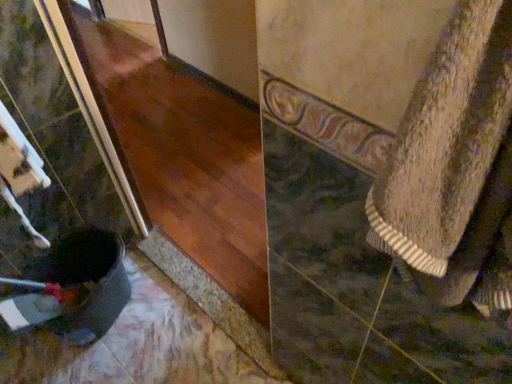
Measure the distance between point (443, 122) and camera.

Point (443, 122) and camera are 31.70 centimeters apart.

The image size is (512, 384). What do you see at coordinates (446, 139) in the screenshot?
I see `textured beige towel at right` at bounding box center [446, 139].

In order to face textured beige towel at right, should I rotate leftwards or rightwards?

You should look right and rotate roughly 26.983 degrees.

This screenshot has width=512, height=384. I want to click on textured beige towel at right, so click(x=446, y=139).

The height and width of the screenshot is (384, 512). What do you see at coordinates (183, 156) in the screenshot? I see `glossy wood at lower left` at bounding box center [183, 156].

At what (x,y) coordinates should I click in order to perform the action: click on glossy wood at lower left. Please return your answer as a coordinate pair (x, y). This screenshot has width=512, height=384. Looking at the image, I should click on (183, 156).

Where is `textured beige towel at right`? The image size is (512, 384). textured beige towel at right is located at coordinates (446, 139).

Which object is positioned more to the right, textured beige towel at right or glossy wood at lower left?

From the viewer's perspective, textured beige towel at right appears more on the right side.

In the image, is textured beige towel at right positioned in front of or behind glossy wood at lower left?

textured beige towel at right is in front of glossy wood at lower left.

Is point (396, 218) positioned after point (111, 66)?

No, (396, 218) is in front of (111, 66).

From the image's perspective, would you say textured beige towel at right is shown under glossy wood at lower left?

Indeed, from the image's perspective, textured beige towel at right is shown beneath glossy wood at lower left.

In the scene shown: From a real-world perspective, who is located higher, textured beige towel at right or glossy wood at lower left?

In real-world perspective, textured beige towel at right is above.

Considering the relative sizes of textured beige towel at right and glossy wood at lower left in the image provided, is textured beige towel at right thinner than glossy wood at lower left?

Incorrect, the width of textured beige towel at right is not less than that of glossy wood at lower left.

From their relative heights in the image, would you say textured beige towel at right is taller or shorter than glossy wood at lower left?

Clearly, textured beige towel at right is shorter compared to glossy wood at lower left.

Can you confirm if textured beige towel at right is smaller than glossy wood at lower left?

Yes, textured beige towel at right is smaller than glossy wood at lower left.

Can we say textured beige towel at right lies outside glossy wood at lower left?

Yes, textured beige towel at right is not within glossy wood at lower left.

Based on the photo, would you consider textured beige towel at right to be distant from glossy wood at lower left?

Yes, textured beige towel at right and glossy wood at lower left are quite far apart.

Is textured beige towel at right aimed at glossy wood at lower left?

No, textured beige towel at right is not facing towards glossy wood at lower left.

How far apart are textured beige towel at right and glossy wood at lower left?

The distance of textured beige towel at right from glossy wood at lower left is 5.65 feet.

Locate an element on the screen. Image resolution: width=512 pixels, height=384 pixels. wood below the textured beige towel at right (from a real-world perspective) is located at coordinates (183, 156).

Is glossy wood at lower left to the left of textured beige towel at right from the viewer's perspective?

Indeed, glossy wood at lower left is positioned on the left side of textured beige towel at right.

Between glossy wood at lower left and textured beige towel at right, which one is positioned in front?

textured beige towel at right is in front.

Is point (129, 96) farther from camera compared to point (426, 165)?

Yes.

From the image's perspective, is glossy wood at lower left positioned above or below textured beige towel at right?

glossy wood at lower left is above textured beige towel at right.

From a real-world perspective, which object stands above the other?

textured beige towel at right.

Can you confirm if glossy wood at lower left is wider than textured beige towel at right?

No.

Considering the relative sizes of glossy wood at lower left and textured beige towel at right in the image provided, is glossy wood at lower left shorter than textured beige towel at right?

Incorrect, the height of glossy wood at lower left does not fall short of that of textured beige towel at right.

Which of these two, glossy wood at lower left or textured beige towel at right, is smaller?

textured beige towel at right.

Would you say glossy wood at lower left is outside textured beige towel at right?

That's correct, glossy wood at lower left is outside of textured beige towel at right.

Is glossy wood at lower left placed right next to textured beige towel at right?

glossy wood at lower left and textured beige towel at right are clearly separated.

Could you tell me if glossy wood at lower left is facing textured beige towel at right?

No, glossy wood at lower left is not turned towards textured beige towel at right.

How different are the orientations of glossy wood at lower left and textured beige towel at right in degrees?

There is a 0.872-degree angle between the facing directions of glossy wood at lower left and textured beige towel at right.

How distant is glossy wood at lower left from textured beige towel at right?

glossy wood at lower left is 5.65 feet away from textured beige towel at right.

The image size is (512, 384). I want to click on towel below the glossy wood at lower left (from the image's perspective), so click(446, 139).

Where is `wood above the textured beige towel at right (from the image's perspective)`? This screenshot has height=384, width=512. wood above the textured beige towel at right (from the image's perspective) is located at coordinates (183, 156).

Identify the location of towel on the right of glossy wood at lower left. 446,139.